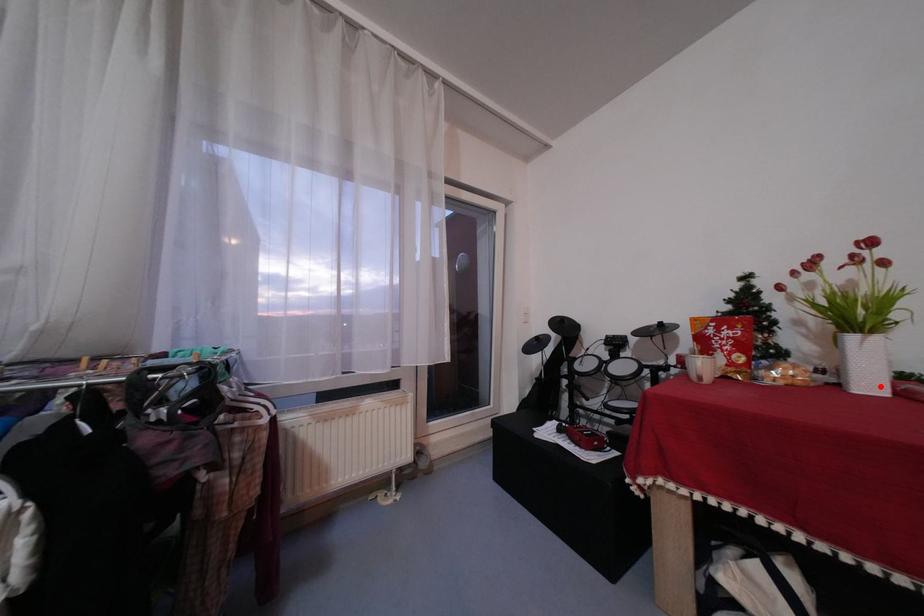
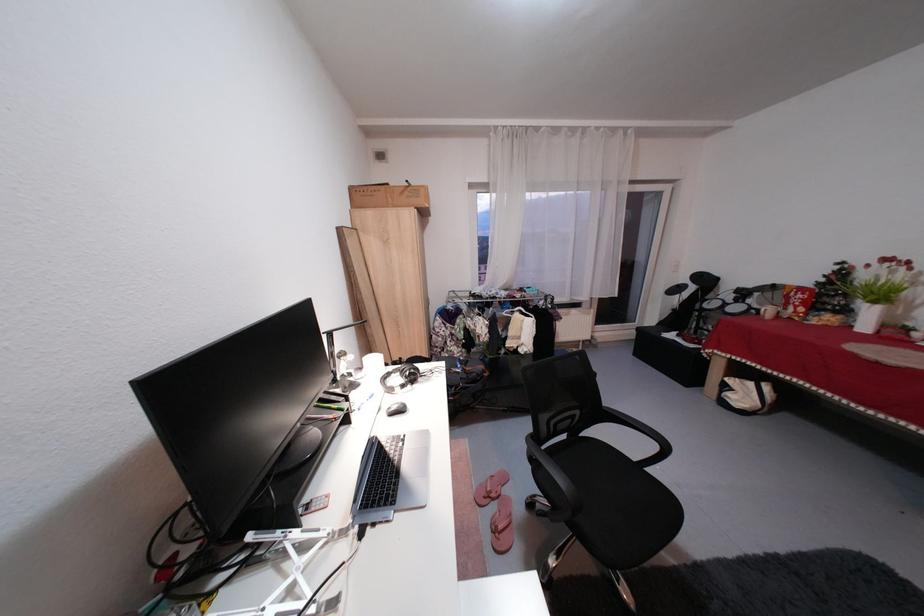
Find the pixel in the second image that matches the highlighted location in the first image.

(877, 330)